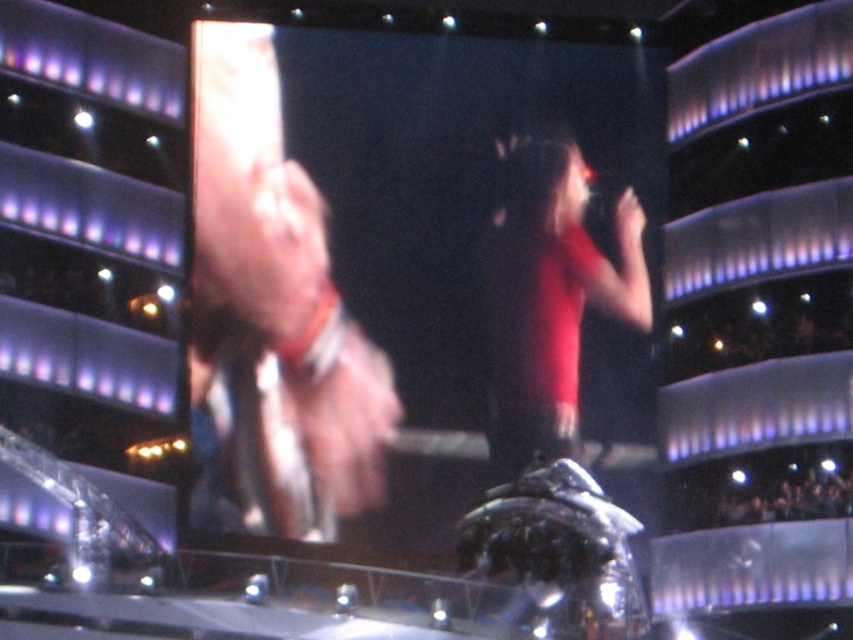
Question: Which point is farther to the camera?

Choices:
 (A) (212, 412)
 (B) (544, 436)

Answer: (B)

Question: In this image, where is smooth skin hand at center located relative to matte red shirt at center?

Choices:
 (A) right
 (B) left

Answer: (B)

Question: Which object appears closest to the camera in this image?

Choices:
 (A) smooth skin hand at center
 (B) matte red shirt at center

Answer: (A)

Question: Does smooth skin hand at center have a smaller size compared to matte red shirt at center?

Choices:
 (A) no
 (B) yes

Answer: (A)

Question: Does smooth skin hand at center appear over matte red shirt at center?

Choices:
 (A) no
 (B) yes

Answer: (B)